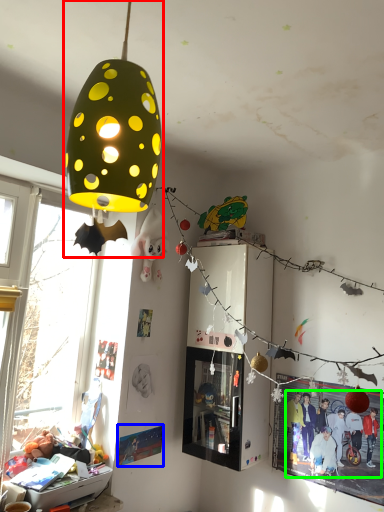
Question: Based on their relative distances, which object is nearer to lamp (highlighted by a red box)? Choose from poster page (highlighted by a blue box) and person (highlighted by a green box).

Choices:
 (A) poster page
 (B) person

Answer: (A)